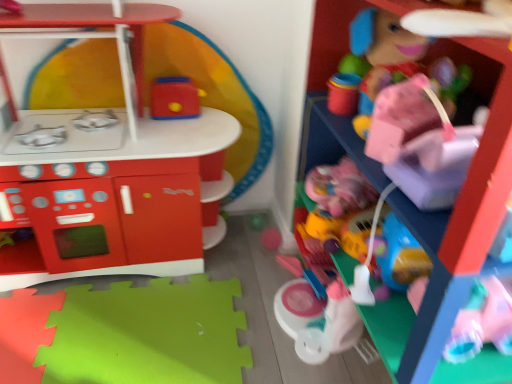
This screenshot has width=512, height=384. What do you see at coordinates (174, 99) in the screenshot?
I see `matte plastic toaster at upper center, which is the third toy in right-to-left order` at bounding box center [174, 99].

The height and width of the screenshot is (384, 512). What are the coordinates of `matte plastic toy car at right, which is the second toy from right to left` in the screenshot? It's located at (346, 216).

Describe the element at coordinates (346, 216) in the screenshot. I see `matte plastic toy car at right, which is the second toy from right to left` at that location.

What do you see at coordinates (458, 212) in the screenshot?
I see `pink plastic toy at upper right, the 1th toy viewed from the right` at bounding box center [458, 212].

In order to face pink plastic toy at upper right, the 1th toy viewed from the right, should I rotate leftwards or rightwards?

To align with it, rotate right about 32.017°.

Find the location of a particular element. The image size is (512, 384). matte plastic toaster at upper center, which is the second toy in left-to-right order is located at coordinates (174, 99).

Is pink plastic toy at upper right, which ranks as the 4th toy in left-to-right order, wider than matte plastic play kitchen at left, positioned as the fourth toy in right-to-left order?

Correct, the width of pink plastic toy at upper right, which ranks as the 4th toy in left-to-right order, exceeds that of matte plastic play kitchen at left, positioned as the fourth toy in right-to-left order.

Is the position of pink plastic toy at upper right, which ranks as the 4th toy in left-to-right order, less distant than that of matte plastic play kitchen at left, positioned as the fourth toy in right-to-left order?

Yes, it is in front of matte plastic play kitchen at left, positioned as the fourth toy in right-to-left order.

From the picture: Are pink plastic toy at upper right, the 1th toy viewed from the right, and matte plastic play kitchen at left, positioned as the fourth toy in right-to-left order, beside each other?

pink plastic toy at upper right, the 1th toy viewed from the right, and matte plastic play kitchen at left, positioned as the fourth toy in right-to-left order, are clearly separated.

From the image's perspective, relative to matte plastic toy car at right, which is counted as the 3th toy, starting from the left, is matte plastic toaster at upper center, which is the third toy in right-to-left order, above or below?

matte plastic toaster at upper center, which is the third toy in right-to-left order, is situated higher than matte plastic toy car at right, which is counted as the 3th toy, starting from the left, in the image.

How distant is matte plastic toaster at upper center, which is the second toy in left-to-right order, from matte plastic toy car at right, which is counted as the 3th toy, starting from the left?

matte plastic toaster at upper center, which is the second toy in left-to-right order, and matte plastic toy car at right, which is counted as the 3th toy, starting from the left, are 22.43 inches apart from each other.

I want to click on toy that appears behind the matte plastic toy car at right, which is counted as the 3th toy, starting from the left, so click(174, 99).

Is matte plastic toy car at right, which is the second toy from right to left, at the back of matte plastic toaster at upper center, which is the third toy in right-to-left order?

No, matte plastic toaster at upper center, which is the third toy in right-to-left order,'s orientation is not away from matte plastic toy car at right, which is the second toy from right to left.

Which of these two, matte plastic play kitchen at left, which ranks as the 1th toy in left-to-right order, or pink plastic toy at upper right, the 1th toy viewed from the right, stands taller?

pink plastic toy at upper right, the 1th toy viewed from the right.

From a real-world perspective, which is physically above, matte plastic play kitchen at left, positioned as the fourth toy in right-to-left order, or pink plastic toy at upper right, which ranks as the 4th toy in left-to-right order?

pink plastic toy at upper right, which ranks as the 4th toy in left-to-right order.

Where is `toy that is the 1st one when counting downward from the matte plastic play kitchen at left, which ranks as the 1th toy in left-to-right order (from the image's perspective)`? toy that is the 1st one when counting downward from the matte plastic play kitchen at left, which ranks as the 1th toy in left-to-right order (from the image's perspective) is located at coordinates [x=458, y=212].

Which of these two, matte plastic play kitchen at left, which ranks as the 1th toy in left-to-right order, or pink plastic toy at upper right, which ranks as the 4th toy in left-to-right order, is smaller?

With smaller size is matte plastic play kitchen at left, which ranks as the 1th toy in left-to-right order.

Who is shorter, matte plastic toy car at right, which is the second toy from right to left, or matte plastic toaster at upper center, which is the second toy in left-to-right order?

matte plastic toaster at upper center, which is the second toy in left-to-right order.

Considering the sizes of matte plastic toy car at right, which is the second toy from right to left, and matte plastic toaster at upper center, which is the second toy in left-to-right order, in the image, is matte plastic toy car at right, which is the second toy from right to left, wider or thinner than matte plastic toaster at upper center, which is the second toy in left-to-right order,?

matte plastic toy car at right, which is the second toy from right to left, is wider than matte plastic toaster at upper center, which is the second toy in left-to-right order.

Considering the relative positions of matte plastic toy car at right, which is the second toy from right to left, and matte plastic toaster at upper center, which is the second toy in left-to-right order, in the image provided, is matte plastic toy car at right, which is the second toy from right to left, behind matte plastic toaster at upper center, which is the second toy in left-to-right order,?

No, matte plastic toy car at right, which is the second toy from right to left, is in front of matte plastic toaster at upper center, which is the second toy in left-to-right order.

Considering the relative sizes of matte plastic toy car at right, which is the second toy from right to left, and matte plastic toaster at upper center, which is the second toy in left-to-right order, in the image provided, is matte plastic toy car at right, which is the second toy from right to left, smaller than matte plastic toaster at upper center, which is the second toy in left-to-right order,?

Actually, matte plastic toy car at right, which is the second toy from right to left, might be larger than matte plastic toaster at upper center, which is the second toy in left-to-right order.

Is matte plastic play kitchen at left, positioned as the fourth toy in right-to-left order, far away from matte plastic toaster at upper center, which is the second toy in left-to-right order?

No, matte plastic play kitchen at left, positioned as the fourth toy in right-to-left order, is not far from matte plastic toaster at upper center, which is the second toy in left-to-right order.

Which object is further away from the camera taking this photo, matte plastic play kitchen at left, which ranks as the 1th toy in left-to-right order, or matte plastic toaster at upper center, which is the second toy in left-to-right order?

matte plastic toaster at upper center, which is the second toy in left-to-right order, is behind.

Could you tell me if matte plastic play kitchen at left, positioned as the fourth toy in right-to-left order, is turned towards matte plastic toaster at upper center, which is the third toy in right-to-left order?

Yes.

In the scene shown: From a real-world perspective, is matte plastic toy car at right, which is counted as the 3th toy, starting from the left, located beneath matte plastic play kitchen at left, which ranks as the 1th toy in left-to-right order?

Yes, from a real-world perspective, matte plastic toy car at right, which is counted as the 3th toy, starting from the left, is beneath matte plastic play kitchen at left, which ranks as the 1th toy in left-to-right order.

From the image's perspective, which object appears higher, matte plastic toy car at right, which is the second toy from right to left, or matte plastic play kitchen at left, which ranks as the 1th toy in left-to-right order?

From the image's view, matte plastic play kitchen at left, which ranks as the 1th toy in left-to-right order, is above.

Based on the photo, is matte plastic play kitchen at left, which ranks as the 1th toy in left-to-right order, located within matte plastic toy car at right, which is the second toy from right to left?

Actually, matte plastic play kitchen at left, which ranks as the 1th toy in left-to-right order, is outside matte plastic toy car at right, which is the second toy from right to left.

Is matte plastic toy car at right, which is the second toy from right to left, taller than matte plastic play kitchen at left, which ranks as the 1th toy in left-to-right order?

Incorrect, the height of matte plastic toy car at right, which is the second toy from right to left, is not larger of that of matte plastic play kitchen at left, which ranks as the 1th toy in left-to-right order.

Could you tell me if matte plastic play kitchen at left, positioned as the fourth toy in right-to-left order, is facing matte plastic toy car at right, which is the second toy from right to left?

No, matte plastic play kitchen at left, positioned as the fourth toy in right-to-left order, is not facing towards matte plastic toy car at right, which is the second toy from right to left.

Is matte plastic play kitchen at left, positioned as the fourth toy in right-to-left order, thinner than matte plastic toy car at right, which is counted as the 3th toy, starting from the left?

In fact, matte plastic play kitchen at left, positioned as the fourth toy in right-to-left order, might be wider than matte plastic toy car at right, which is counted as the 3th toy, starting from the left.

From the image's perspective, which toy is the 1st one above the pink plastic toy at upper right, which ranks as the 4th toy in left-to-right order? Please provide its 2D coordinates.

[(105, 166)]

Locate an element on the screen. The width and height of the screenshot is (512, 384). toy behind the matte plastic toy car at right, which is the second toy from right to left is located at coordinates 174,99.

From the image, which object appears to be nearer to pink plastic toy at upper right, the 1th toy viewed from the right, matte plastic play kitchen at left, which ranks as the 1th toy in left-to-right order, or matte plastic toy car at right, which is counted as the 3th toy, starting from the left?

The object closer to pink plastic toy at upper right, the 1th toy viewed from the right, is matte plastic toy car at right, which is counted as the 3th toy, starting from the left.

Estimate the real-world distances between objects in this image. Which object is further from pink plastic toy at upper right, which ranks as the 4th toy in left-to-right order, matte plastic play kitchen at left, positioned as the fourth toy in right-to-left order, or matte plastic toaster at upper center, which is the second toy in left-to-right order?

matte plastic play kitchen at left, positioned as the fourth toy in right-to-left order, is positioned further to the anchor pink plastic toy at upper right, which ranks as the 4th toy in left-to-right order.

From the image, which object appears to be farther from pink plastic toy at upper right, which ranks as the 4th toy in left-to-right order, matte plastic toy car at right, which is the second toy from right to left, or matte plastic toaster at upper center, which is the second toy in left-to-right order?

matte plastic toaster at upper center, which is the second toy in left-to-right order.

From the image, which object appears to be nearer to matte plastic play kitchen at left, which ranks as the 1th toy in left-to-right order, matte plastic toaster at upper center, which is the third toy in right-to-left order, or pink plastic toy at upper right, which ranks as the 4th toy in left-to-right order?

Among the two, matte plastic toaster at upper center, which is the third toy in right-to-left order, is located nearer to matte plastic play kitchen at left, which ranks as the 1th toy in left-to-right order.

From the image, which object appears to be farther from matte plastic toaster at upper center, which is the third toy in right-to-left order, matte plastic toy car at right, which is counted as the 3th toy, starting from the left, or matte plastic play kitchen at left, which ranks as the 1th toy in left-to-right order?

Among the two, matte plastic toy car at right, which is counted as the 3th toy, starting from the left, is located further to matte plastic toaster at upper center, which is the third toy in right-to-left order.

When comparing their distances from matte plastic toy car at right, which is counted as the 3th toy, starting from the left, does matte plastic play kitchen at left, positioned as the fourth toy in right-to-left order, or matte plastic toaster at upper center, which is the third toy in right-to-left order, seem closer?

The object closer to matte plastic toy car at right, which is counted as the 3th toy, starting from the left, is matte plastic toaster at upper center, which is the third toy in right-to-left order.

Estimate the real-world distances between objects in this image. Which object is closer to matte plastic toy car at right, which is counted as the 3th toy, starting from the left, matte plastic toaster at upper center, which is the third toy in right-to-left order, or pink plastic toy at upper right, the 1th toy viewed from the right?

Based on the image, pink plastic toy at upper right, the 1th toy viewed from the right, appears to be nearer to matte plastic toy car at right, which is counted as the 3th toy, starting from the left.

Which object lies nearer to the anchor point matte plastic toaster at upper center, which is the third toy in right-to-left order, pink plastic toy at upper right, which ranks as the 4th toy in left-to-right order, or matte plastic toy car at right, which is counted as the 3th toy, starting from the left?

matte plastic toy car at right, which is counted as the 3th toy, starting from the left, is positioned closer to the anchor matte plastic toaster at upper center, which is the third toy in right-to-left order.

In order to click on toy between matte plastic toaster at upper center, which is the third toy in right-to-left order, and pink plastic toy at upper right, which ranks as the 4th toy in left-to-right order, from left to right in this screenshot , I will do `click(346, 216)`.

At what (x,y) coordinates should I click in order to perform the action: click on toy between matte plastic play kitchen at left, positioned as the fourth toy in right-to-left order, and matte plastic toy car at right, which is counted as the 3th toy, starting from the left, from left to right. Please return your answer as a coordinate pair (x, y). The width and height of the screenshot is (512, 384). Looking at the image, I should click on (174, 99).